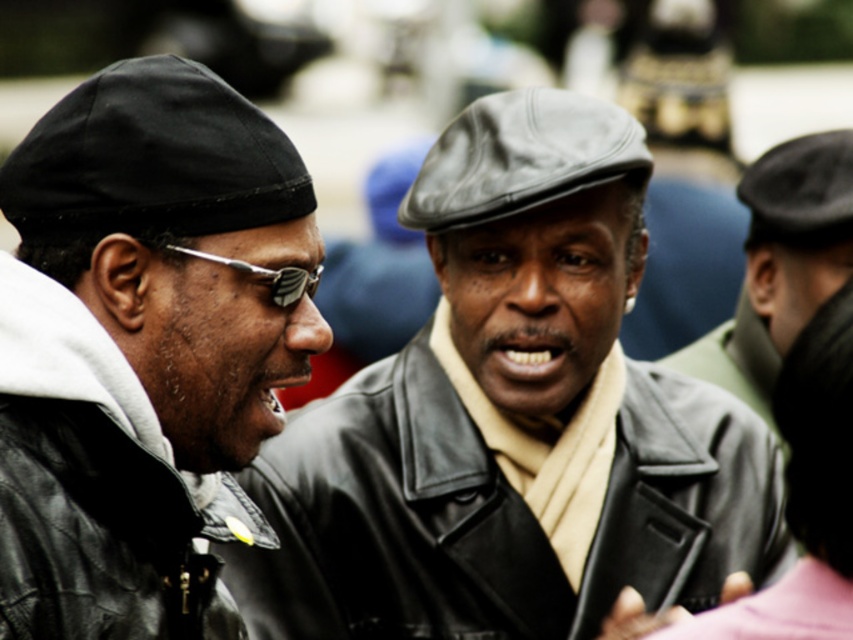
Is black leather jacket at center taller than black leather jacket at left?

Yes, black leather jacket at center is taller than black leather jacket at left.

Can you confirm if black leather jacket at center is positioned below black leather jacket at left?

Indeed, black leather jacket at center is positioned under black leather jacket at left.

The width and height of the screenshot is (853, 640). Describe the element at coordinates (496, 513) in the screenshot. I see `black leather jacket at center` at that location.

Identify the location of black leather jacket at center. (496, 513).

Is black leather jacket at left thinner than leather cap at right?

Correct, black leather jacket at left's width is less than leather cap at right's.

Does black leather jacket at left have a larger size compared to leather cap at right?

No.

Is point (42, 490) more distant than point (776, 179)?

No, it is in front of (776, 179).

Find the location of a particular element. black leather jacket at left is located at coordinates (97, 486).

Is black leather jacket at center closer to camera compared to leather cap at right?

Yes.

Locate an element on the screen. black leather jacket at center is located at coordinates (496, 513).

Image resolution: width=853 pixels, height=640 pixels. Find the location of `black leather jacket at center`. black leather jacket at center is located at coordinates (496, 513).